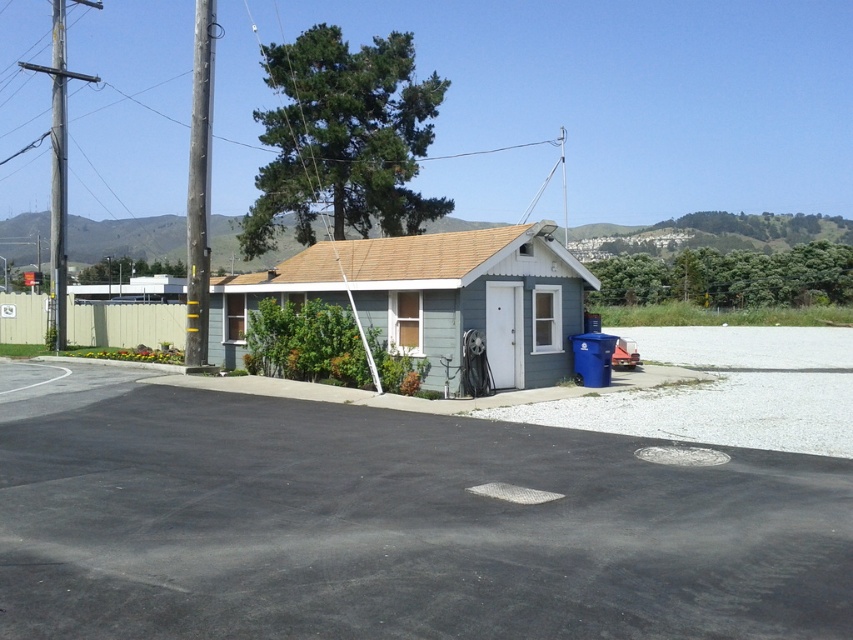
Who is taller, light blue siding at center or brushed metal utility pole at left?

brushed metal utility pole at left is taller.

The image size is (853, 640). What are the coordinates of `light blue siding at center` in the screenshot? It's located at click(x=434, y=298).

Is black asphalt parking lot at lower left to the right of brushed metal utility pole at left from the viewer's perspective?

Indeed, black asphalt parking lot at lower left is positioned on the right side of brushed metal utility pole at left.

Can you confirm if black asphalt parking lot at lower left is thinner than brushed metal utility pole at left?

Yes.

Does point (485, 547) lie in front of point (61, 58)?

That is True.

Where is `black asphalt parking lot at lower left`? black asphalt parking lot at lower left is located at coordinates (392, 524).

Between black asphalt parking lot at lower left and light blue siding at center, which one appears on the right side from the viewer's perspective?

light blue siding at center

Is point (462, 545) behind point (347, 259)?

No, (462, 545) is closer to viewer.

What are the coordinates of `black asphalt parking lot at lower left` in the screenshot? It's located at (392, 524).

I want to click on black asphalt parking lot at lower left, so click(392, 524).